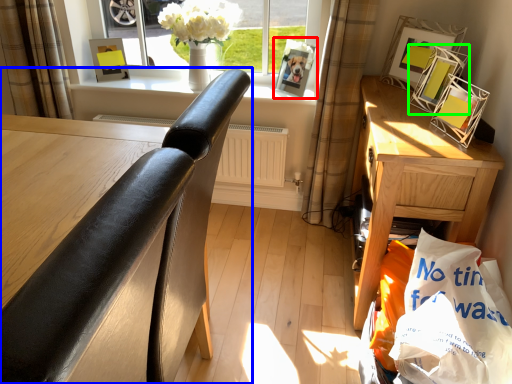
Question: Which object is the farthest from picture frame (highlighted by a red box)? Choose among these: chair (highlighted by a blue box) or picture frame (highlighted by a green box).

Choices:
 (A) chair
 (B) picture frame

Answer: (A)